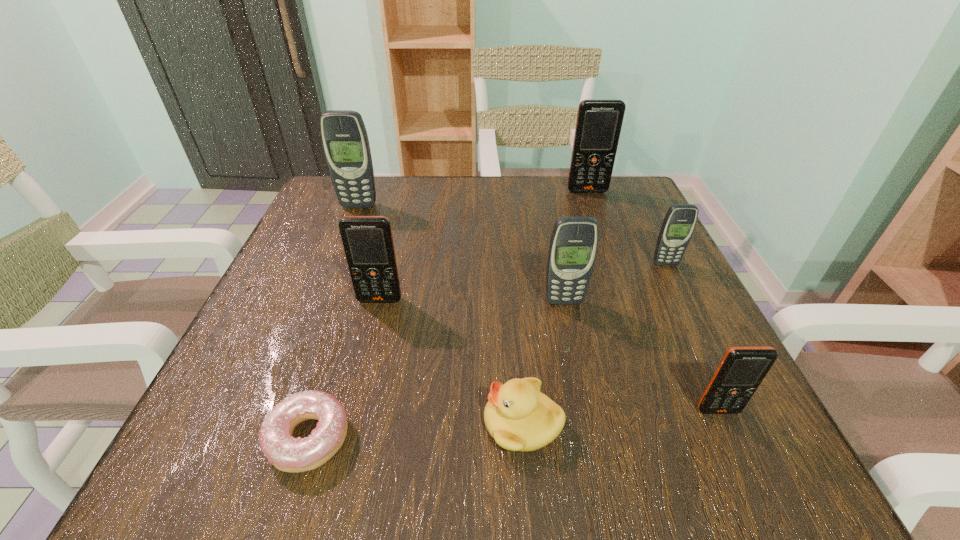
This screenshot has height=540, width=960. I want to click on the biggest orange cellular telephone, so click(599, 122).

I want to click on the farthest orange cellular telephone, so [599, 122].

I want to click on the seventh nearest object, so click(x=344, y=137).

In order to click on the leftmost cellular telephone in this screenshot , I will do `click(344, 137)`.

Identify the location of the nearest gray cellular telephone. (573, 246).

You are a GUI agent. You are given a task and a screenshot of the screen. Output one action in this format:
    pyautogui.click(x=<x>, y=<y>)
    Task: Click on the fourth cellular telephone from right to left
    
    Given the screenshot: What is the action you would take?
    pyautogui.click(x=573, y=246)

This screenshot has height=540, width=960. Find the location of `the leftmost orange cellular telephone`. the leftmost orange cellular telephone is located at coordinates (368, 243).

Locate an element on the screen. This screenshot has width=960, height=540. the second cellular telephone from left to right is located at coordinates (368, 243).

Locate an element on the screen. the nearest cellular telephone is located at coordinates [742, 369].

Where is `the smallest orange cellular telephone`? the smallest orange cellular telephone is located at coordinates (742, 369).